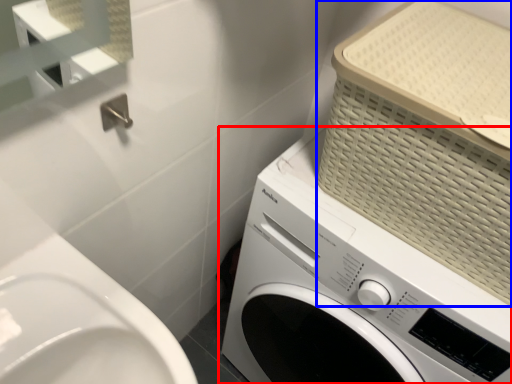
Question: Among these objects, which one is farthest to the camera, washing machine (highlighted by a red box) or basket (highlighted by a blue box)?

Choices:
 (A) washing machine
 (B) basket

Answer: (A)